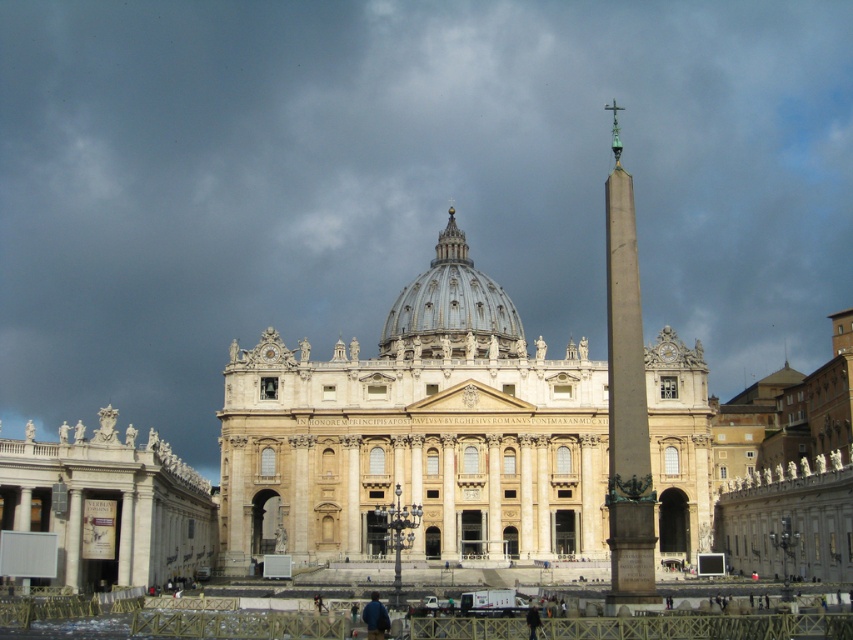
Question: Which object is closer to the camera taking this photo?

Choices:
 (A) white marble statues at left
 (B) polished bronze obelisk at right

Answer: (B)

Question: Among these objects, which one is nearest to the camera?

Choices:
 (A) light beige stone palace at center
 (B) white marble statues at left
 (C) polished bronze obelisk at right

Answer: (C)

Question: Is polished bronze obelisk at right positioned at the back of white marble dome at center?

Choices:
 (A) yes
 (B) no

Answer: (B)

Question: Which of these objects is positioned closest to the white marble dome at center?

Choices:
 (A) light beige stone palace at center
 (B) white marble statues at left

Answer: (A)

Question: Considering the relative positions of light beige stone palace at center and white marble dome at center in the image provided, where is light beige stone palace at center located with respect to white marble dome at center?

Choices:
 (A) below
 (B) above

Answer: (A)

Question: Is the position of polished bronze obelisk at right more distant than that of white marble dome at center?

Choices:
 (A) no
 (B) yes

Answer: (A)